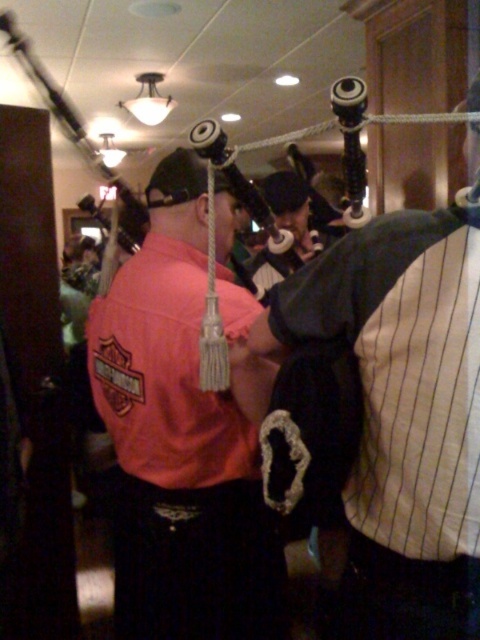
Question: Is the position of pink fabric shirt at center more distant than that of black matte bagpipes at center?

Choices:
 (A) no
 (B) yes

Answer: (B)

Question: Which of the following is the closest to the observer?

Choices:
 (A) pink fabric shirt at center
 (B) black matte bagpipes at center

Answer: (B)

Question: Is pink fabric shirt at center to the right of black matte bagpipes at center from the viewer's perspective?

Choices:
 (A) no
 (B) yes

Answer: (A)

Question: Which of the following is the closest to the observer?

Choices:
 (A) (360, 337)
 (B) (168, 552)

Answer: (A)

Question: Which point is farther to the camera?

Choices:
 (A) (111, 353)
 (B) (475, 532)

Answer: (A)

Question: Does pink fabric shirt at center lie in front of black matte bagpipes at center?

Choices:
 (A) no
 (B) yes

Answer: (A)